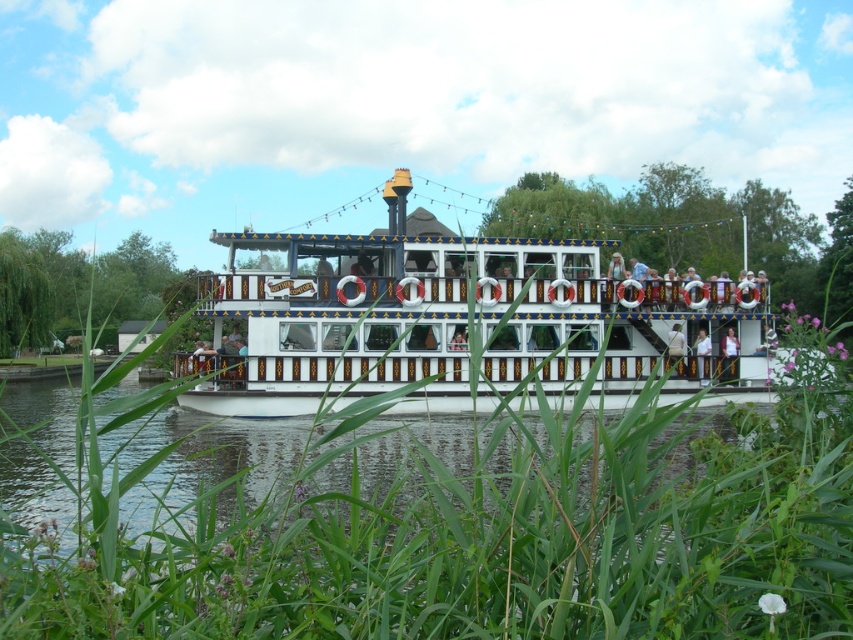
Question: Is white painted wood boat at center wider than white smooth water at center?

Choices:
 (A) no
 (B) yes

Answer: (A)

Question: Which point is farther from the camera taking this photo?

Choices:
 (A) (480, 600)
 (B) (383, 480)

Answer: (B)

Question: Is white painted wooden boat at center to the right of white smooth water at center from the viewer's perspective?

Choices:
 (A) no
 (B) yes

Answer: (B)

Question: Which point is farther to the camera?

Choices:
 (A) (689, 394)
 (B) (151, 465)
 (C) (12, 628)

Answer: (A)

Question: Is white painted wood boat at center thinner than white smooth water at center?

Choices:
 (A) yes
 (B) no

Answer: (A)

Question: Which of the following is the closest to the observer?

Choices:
 (A) white painted wood boat at center
 (B) white smooth water at center
 (C) white painted wooden boat at center

Answer: (C)